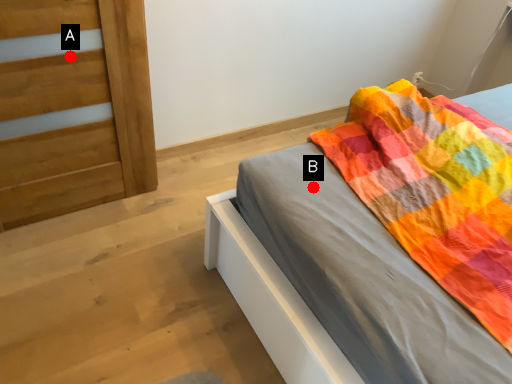
Question: Two points are circled on the image, labeled by A and B beside each circle. Which point appears closest to the camera in this image?

Choices:
 (A) A is closer
 (B) B is closer

Answer: (B)